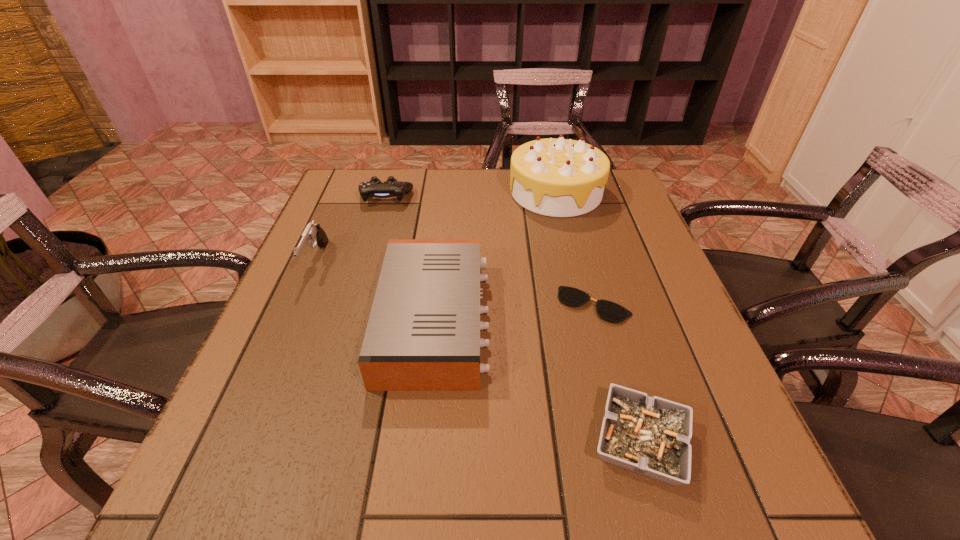
Find the location of a particular element. birthday cake is located at coordinates (560, 177).

Locate an element on the screen. The height and width of the screenshot is (540, 960). the leftmost object is located at coordinates (313, 233).

Find the location of a particular element. The width and height of the screenshot is (960, 540). radio receiver is located at coordinates click(423, 334).

Find the location of `the fourth tallest object`. the fourth tallest object is located at coordinates (374, 188).

Identify the location of the nearest object. The image size is (960, 540). point(651,436).

I want to click on the second shortest object, so click(651, 436).

The height and width of the screenshot is (540, 960). Identify the location of spectacles. (613, 312).

Where is `vacant space positioned 0.340m on the front of the tallest object`? The width and height of the screenshot is (960, 540). vacant space positioned 0.340m on the front of the tallest object is located at coordinates (585, 312).

Where is `vacant region located at the muzzle of the gun`? This screenshot has height=540, width=960. vacant region located at the muzzle of the gun is located at coordinates tap(291, 321).

The image size is (960, 540). I want to click on vacant space situated on the control panel of the third tallest object, so pos(513,321).